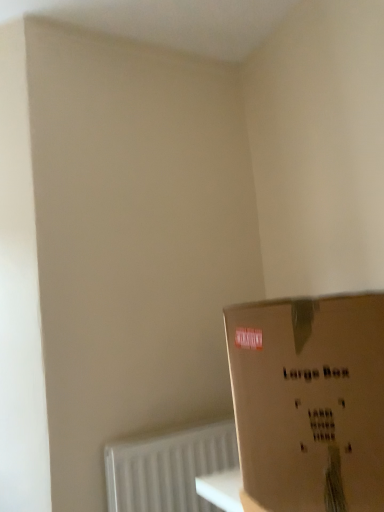
Question: From a real-world perspective, is white textured radiator at lower left positioned above or below brown cardboard box at lower right?

Choices:
 (A) above
 (B) below

Answer: (B)

Question: Do you think white textured radiator at lower left is within brown cardboard box at lower right, or outside of it?

Choices:
 (A) inside
 (B) outside

Answer: (B)

Question: Is point (163, 498) closer or farther from the camera than point (235, 388)?

Choices:
 (A) closer
 (B) farther

Answer: (B)

Question: In terms of size, does brown cardboard box at lower right appear bigger or smaller than white textured radiator at lower left?

Choices:
 (A) big
 (B) small

Answer: (A)

Question: Considering the positions of brown cardboard box at lower right and white textured radiator at lower left in the image, is brown cardboard box at lower right wider or thinner than white textured radiator at lower left?

Choices:
 (A) wide
 (B) thin

Answer: (A)

Question: Choose the correct answer: Is brown cardboard box at lower right inside white textured radiator at lower left or outside it?

Choices:
 (A) inside
 (B) outside

Answer: (B)

Question: Is brown cardboard box at lower right in front of or behind white textured radiator at lower left in the image?

Choices:
 (A) front
 (B) behind

Answer: (A)